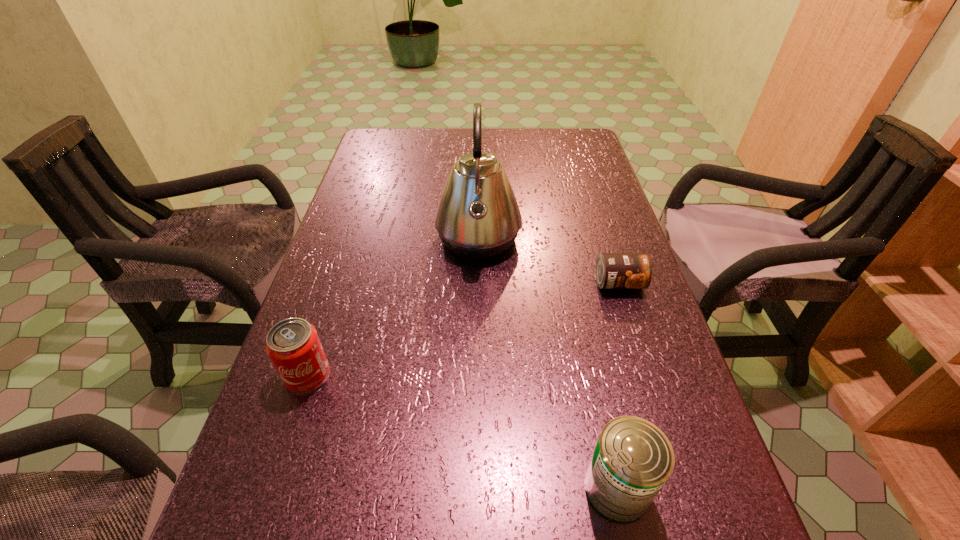
The height and width of the screenshot is (540, 960). I want to click on unoccupied area between the shortest can and the kettle, so click(x=548, y=261).

Find the location of a particular element. This screenshot has width=960, height=540. vacant space that is in between the nearest can and the leftmost object is located at coordinates (462, 432).

I want to click on free space between the second object from right to left and the leftmost can, so click(x=462, y=432).

The width and height of the screenshot is (960, 540). I want to click on free space between the rightmost can and the third object from left to right, so click(617, 386).

This screenshot has height=540, width=960. Identify the location of empty space that is in between the third farthest object and the rightmost can. (463, 329).

Identify the location of empty location between the rightmost can and the second farthest can. (463, 329).

Image resolution: width=960 pixels, height=540 pixels. I want to click on vacant area that lies between the tallest object and the second object from right to left, so click(547, 364).

You are a GUI agent. You are given a task and a screenshot of the screen. Output one action in this format:
    pyautogui.click(x=<x>, y=<y>)
    Task: Click on the second closest object to the nearest can
    This screenshot has width=960, height=540.
    Given the screenshot: What is the action you would take?
    pyautogui.click(x=477, y=217)

At what (x,y) coordinates should I click in order to perform the action: click on object that can be found as the second closest to the nearest can. Please return your answer as a coordinate pair (x, y). The height and width of the screenshot is (540, 960). Looking at the image, I should click on (477, 217).

Image resolution: width=960 pixels, height=540 pixels. I want to click on can that is the second closest one to the leftmost can, so click(613, 270).